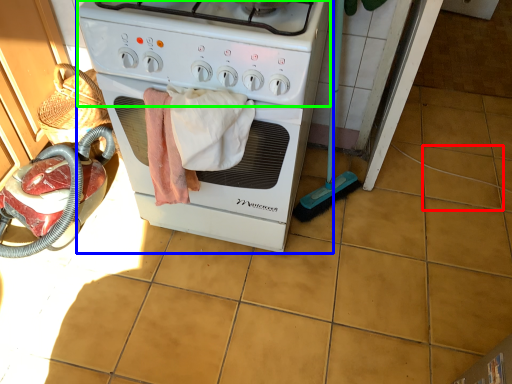
Question: Which object is positioned farthest from tile (highlighted by a red box)? Select from home appliance (highlighted by a blue box) and gas stove (highlighted by a green box).

Choices:
 (A) home appliance
 (B) gas stove

Answer: (B)